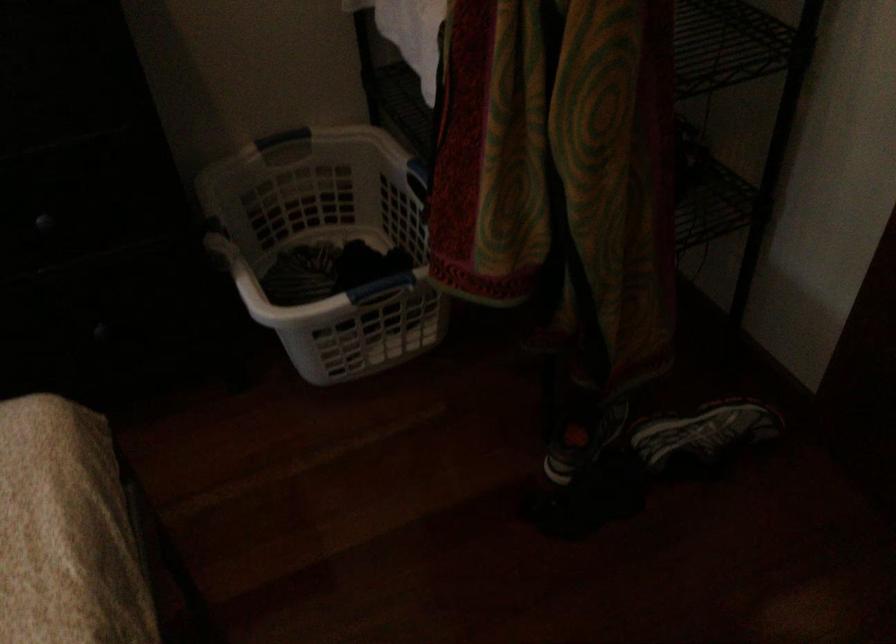
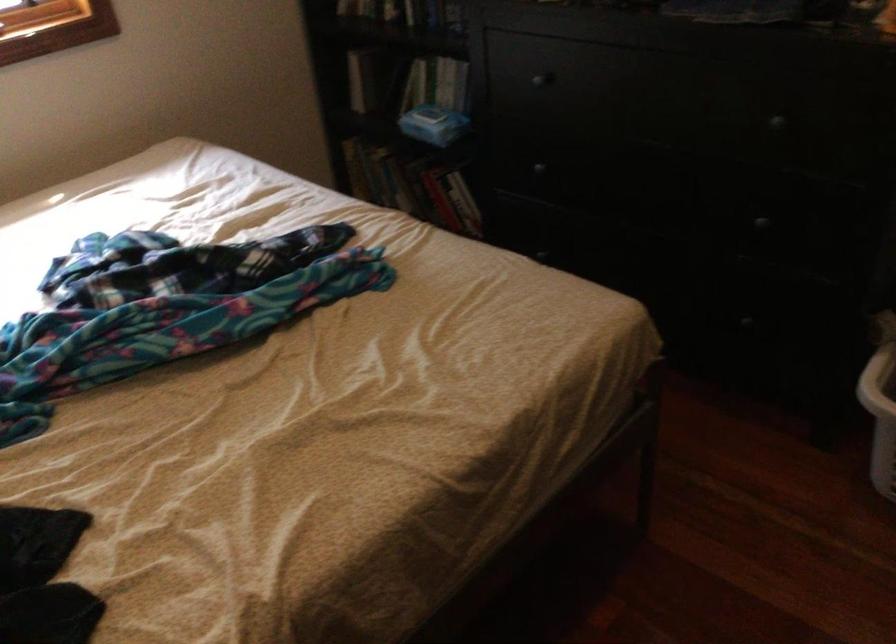
Question: The images are taken continuously from a first-person perspective. In which direction is your viewpoint rotating?

Choices:
 (A) Left
 (B) Right
 (C) Up
 (D) Down

Answer: (A)